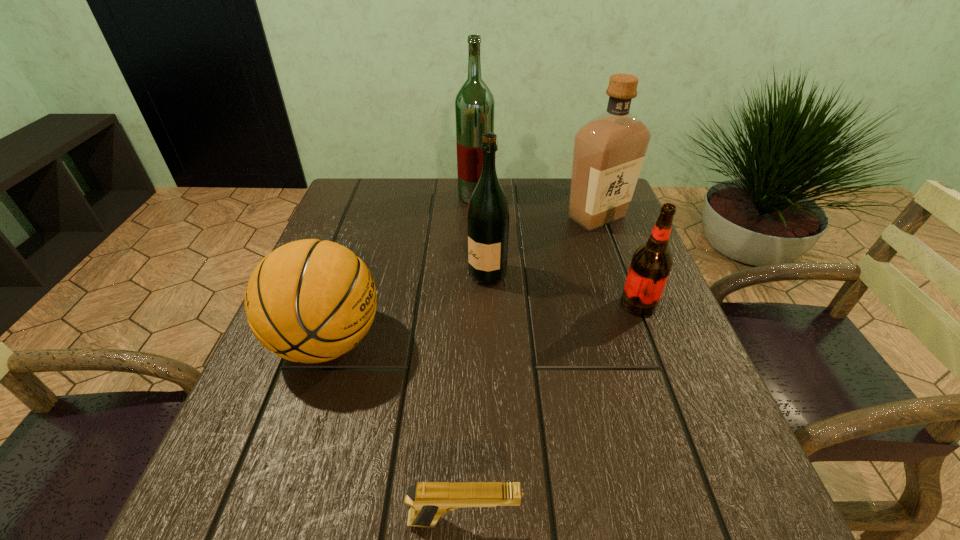
Identify the location of blank space at the left edge of the desktop. (349, 354).

This screenshot has width=960, height=540. I want to click on vacant space at the right edge of the desktop, so click(605, 252).

In the image, there is a desktop. What are the coordinates of `vacant space at the far left corner` in the screenshot? It's located at (382, 219).

At what (x,y) coordinates should I click in order to perform the action: click on free space at the near left corner of the desktop. Please return your answer as a coordinate pair (x, y). Image resolution: width=960 pixels, height=540 pixels. Looking at the image, I should click on (219, 517).

Locate an element on the screen. The width and height of the screenshot is (960, 540). free space between the root beer and the rightmost liquor is located at coordinates (617, 261).

At what (x,y) coordinates should I click in order to perform the action: click on vacant area between the root beer and the third farthest object. Please return your answer as a coordinate pair (x, y). The height and width of the screenshot is (540, 960). Looking at the image, I should click on (563, 289).

Where is `free spot between the leftmost object and the root beer`? The image size is (960, 540). free spot between the leftmost object and the root beer is located at coordinates (483, 323).

At what (x,y) coordinates should I click in order to perform the action: click on free area in between the root beer and the basketball. Please return your answer as a coordinate pair (x, y). The image size is (960, 540). Looking at the image, I should click on (483, 323).

What are the coordinates of `vacant space in between the nearest liquor and the basketball` in the screenshot? It's located at (407, 308).

Find the location of a particular element. This screenshot has width=960, height=540. free space between the leftmost object and the root beer is located at coordinates (483, 323).